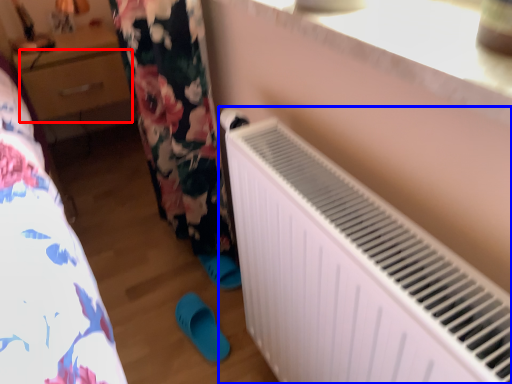
Question: Which object is further to the camera taking this photo, drawer (highlighted by a red box) or radiator (highlighted by a blue box)?

Choices:
 (A) drawer
 (B) radiator

Answer: (A)